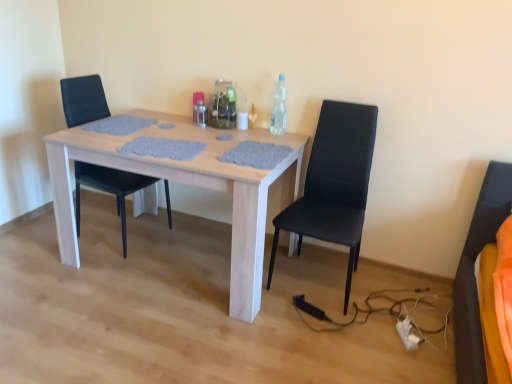
Image resolution: width=512 pixels, height=384 pixels. Find the location of `empty space that is ontop of light wood table at center`. empty space that is ontop of light wood table at center is located at coordinates (177, 134).